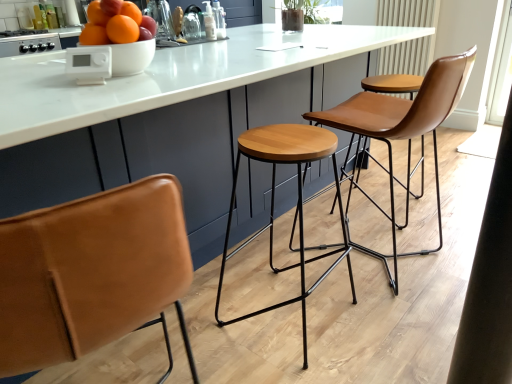
Question: Should I look upward or downward to see white matte bowl at upper center?

Choices:
 (A) down
 (B) up

Answer: (B)

Question: From the image's perspective, does white matte bowl at upper center appear higher than white plastic device at upper center, which is the 2th appliance in back-to-front order?

Choices:
 (A) no
 (B) yes

Answer: (B)

Question: Can white plastic device at upper center, which is the 2th appliance in back-to-front order, be found inside white matte bowl at upper center?

Choices:
 (A) yes
 (B) no

Answer: (B)

Question: Considering the relative sizes of white matte bowl at upper center and white plastic device at upper center, which is the 2th appliance in top-to-bottom order, in the image provided, is white matte bowl at upper center bigger than white plastic device at upper center, which is the 2th appliance in top-to-bottom order,?

Choices:
 (A) no
 (B) yes

Answer: (B)

Question: Does white matte bowl at upper center have a lesser height compared to white plastic device at upper center, which is the 2th appliance in top-to-bottom order?

Choices:
 (A) no
 (B) yes

Answer: (A)

Question: Are white matte bowl at upper center and white plastic device at upper center, positioned as the second appliance in left-to-right order, beside each other?

Choices:
 (A) yes
 (B) no

Answer: (A)

Question: Is white plastic device at upper center, positioned as the second appliance in left-to-right order, at the back of white matte bowl at upper center?

Choices:
 (A) yes
 (B) no

Answer: (B)

Question: From the image's perspective, is white textured radiator at upper right under white matte bowl at upper center?

Choices:
 (A) no
 (B) yes

Answer: (A)

Question: Can you see white textured radiator at upper right touching white matte bowl at upper center?

Choices:
 (A) yes
 (B) no

Answer: (B)

Question: Can white matte bowl at upper center be found inside white textured radiator at upper right?

Choices:
 (A) yes
 (B) no

Answer: (B)

Question: From a real-world perspective, does white textured radiator at upper right sit lower than white matte bowl at upper center?

Choices:
 (A) yes
 (B) no

Answer: (A)

Question: Does white textured radiator at upper right appear on the right side of white matte bowl at upper center?

Choices:
 (A) yes
 (B) no

Answer: (A)

Question: Is white textured radiator at upper right looking in the opposite direction of white matte bowl at upper center?

Choices:
 (A) yes
 (B) no

Answer: (B)

Question: Is shiny orange fruits at upper left positioned in front of white marble table at center?

Choices:
 (A) no
 (B) yes

Answer: (A)